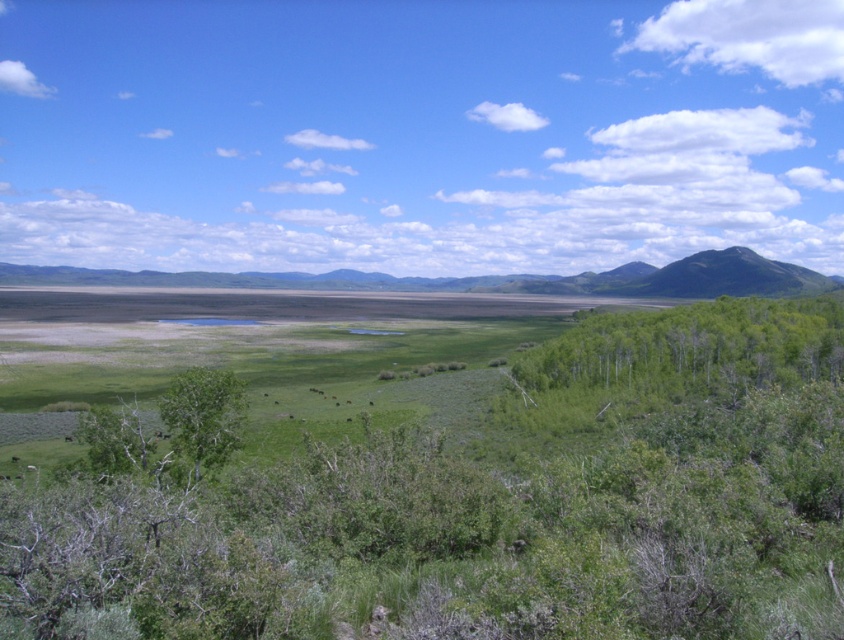
You are a hiker trying to navigate through the landscape. You see the green leafy trees at right and the green leafy tree at center. Which one appears larger from your current viewpoint?

The green leafy trees at right appears larger than the green leafy tree at center from your current viewpoint.

You are a hiker planning to cross the dry lakebed in the middle ground. You see the green leafy trees at right in the distance. How far apart are they from each other?

The green leafy trees at right are 289.50 feet apart.

You are a hiker trying to navigate through the landscape. You need to find a path that goes between the green leafy trees at right and the green leafy tree at center. Which direction should you head to pass between them?

To navigate between the green leafy trees at right and the green leafy tree at center, you should head towards the right side of the green leafy tree at center since the green leafy trees at right is positioned to its right.